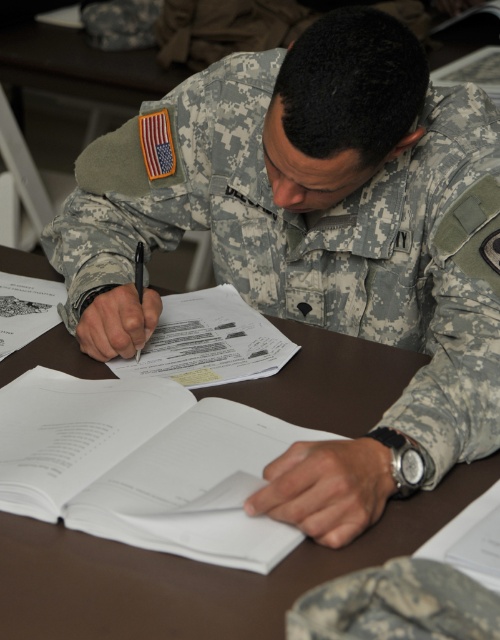
You are a military assistant needing to place a new report on the table. Can you place it in front of the white paper book at center without moving the brown wooden table at center?

The brown wooden table at center is closer to the viewer than the white paper book at center, so you can place the new report in front of the white paper book at center by positioning it between the viewer and the white paper book at center on the brown wooden table at center.